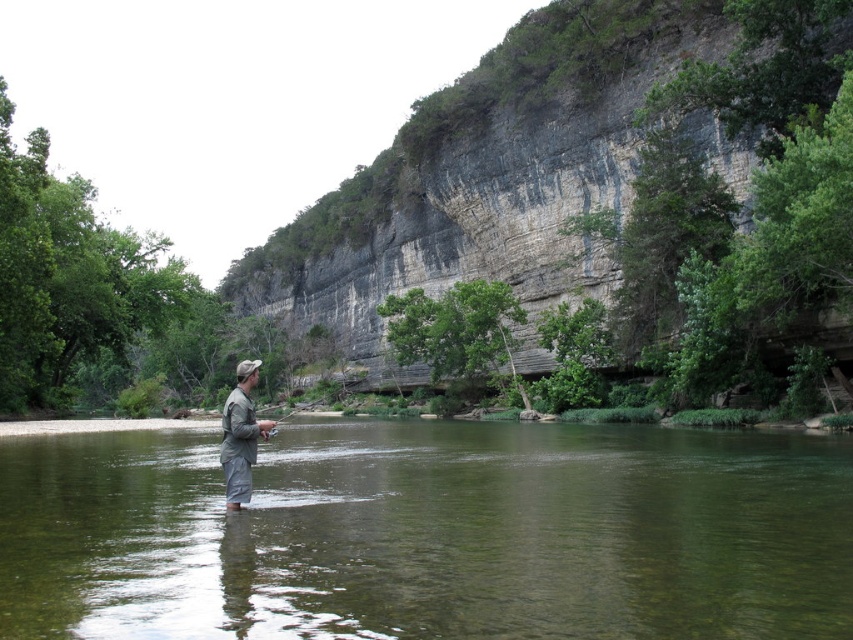
You are standing on the riverbank and see the clear water at center and the gray rock cliff at center. Which object is closer to your right side?

The clear water at center is positioned on the right side of gray rock cliff at center, so the clear water at center is closer to your right side.